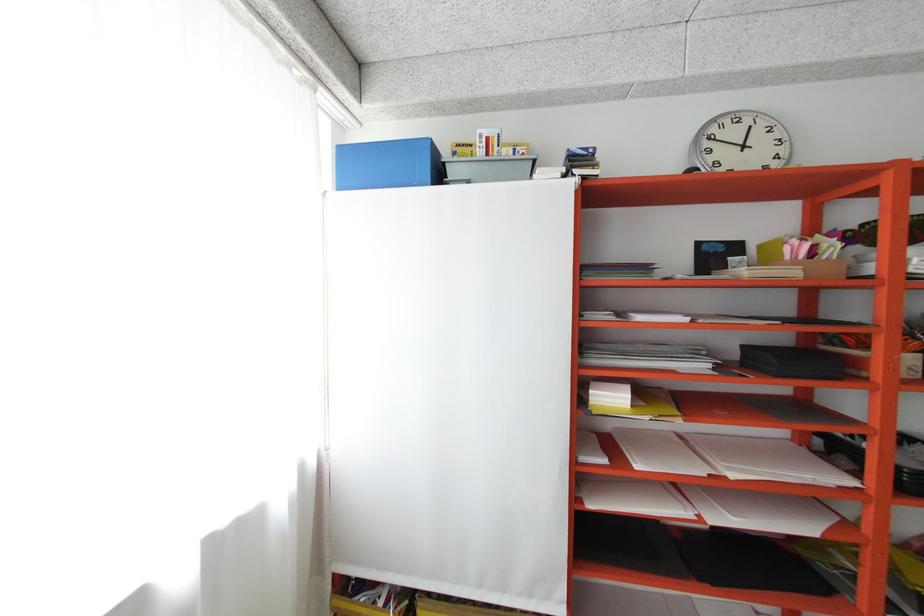
This screenshot has height=616, width=924. Identify the location of grey plastic bin. (489, 168).